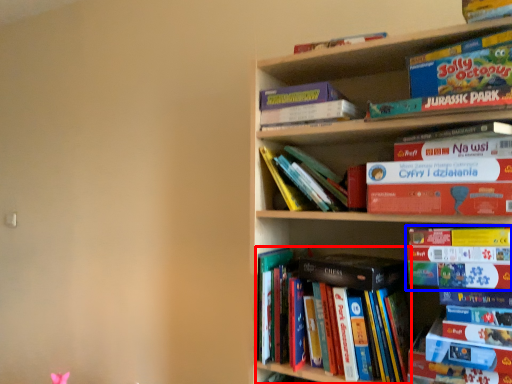
Question: Which of the following is the closest to the observer, book (highlighted by a red box) or book (highlighted by a blue box)?

Choices:
 (A) book
 (B) book

Answer: (B)